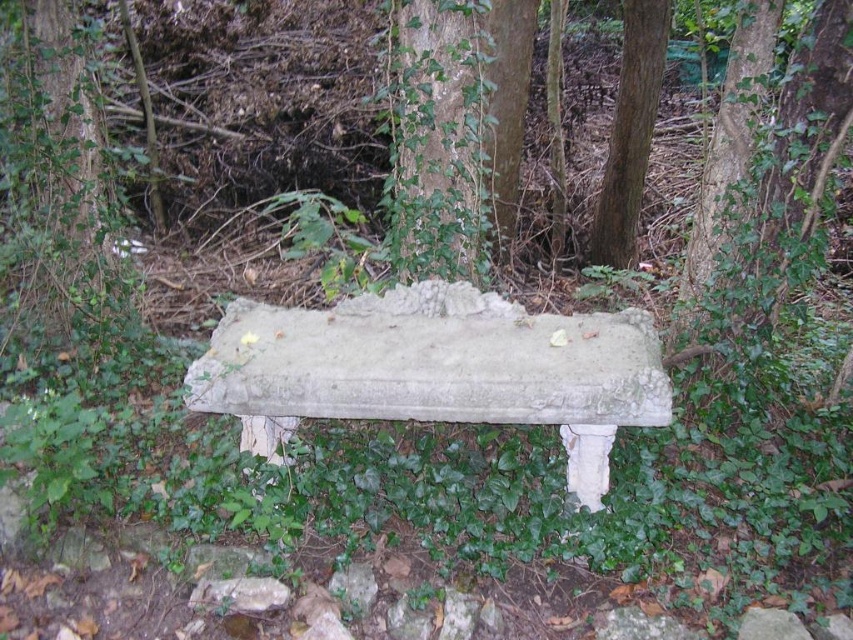
You are a gardener who wants to plant a new shrub between the green leafy tree at left and the smooth brown tree trunk at center right. The shrub requires a minimum of 10 feet of space between it and any other plants. Can you plant the shrub in this location?

The distance between the green leafy tree at left and the smooth brown tree trunk at center right is 15.72 feet, which is more than the required 10 feet. Therefore, you can plant the shrub between them as there is sufficient space.

Looking at this image, you are standing 10 feet away from the weathered stone bench in the image. There is a point at coordinates point (x=619, y=310) on the bench. Can you reach this point without moving closer than your current position?

The distance of point (x=619, y=310) from viewer is 11.81 feet, so you are currently 10 feet away and cannot reach it without moving closer.